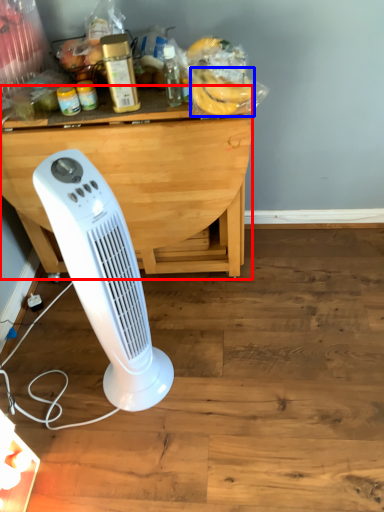
Question: Among these objects, which one is nearest to the camera, table (highlighted by a red box) or banana (highlighted by a blue box)?

Choices:
 (A) table
 (B) banana

Answer: (B)